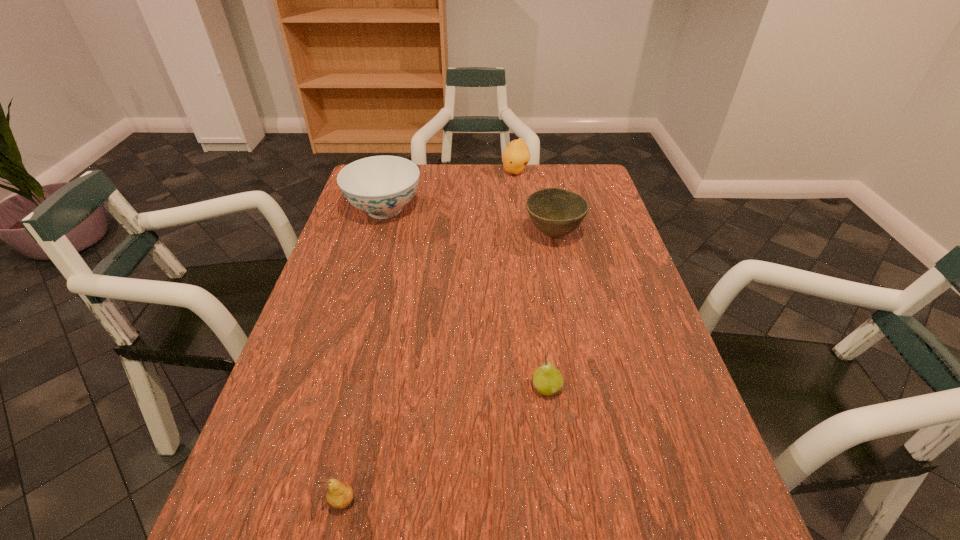
This screenshot has width=960, height=540. Identify the location of vacant space at the right edge. (627, 241).

Where is `free space at the far right corner`? This screenshot has height=540, width=960. free space at the far right corner is located at coordinates (570, 168).

At what (x,y) coordinates should I click in order to perform the action: click on free space between the chinaware and the nearest object. Please return your answer as a coordinate pair (x, y). Looking at the image, I should click on (364, 355).

Image resolution: width=960 pixels, height=540 pixels. In order to click on vacant area that lies between the second nearest object and the chinaware in this screenshot , I will do `click(466, 299)`.

In order to click on free space between the chinaware and the leftmost pear in this screenshot , I will do click(364, 355).

This screenshot has height=540, width=960. I want to click on empty location between the farthest pear and the chinaware, so click(x=450, y=191).

Identify the location of free space between the second farthest pear and the farthest object. (531, 280).

Where is `empty space that is in between the chinaware and the leftmost pear`? This screenshot has height=540, width=960. empty space that is in between the chinaware and the leftmost pear is located at coordinates (364, 355).

At what (x,y) coordinates should I click in order to perform the action: click on free point between the chinaware and the second nearest pear. Please return your answer as a coordinate pair (x, y). The width and height of the screenshot is (960, 540). Looking at the image, I should click on (466, 299).

You are a GUI agent. You are given a task and a screenshot of the screen. Output one action in this format:
    pyautogui.click(x=<x>, y=<y>)
    Task: Click on the vacant region between the chinaware and the farthest pear
    The height and width of the screenshot is (540, 960).
    Given the screenshot: What is the action you would take?
    pyautogui.click(x=450, y=191)